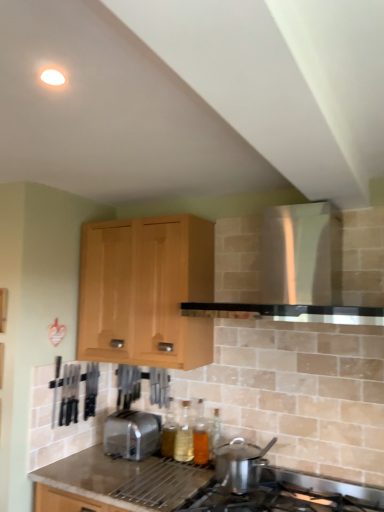
Identify the location of free space in front of satin silver toaster at lower center. (116, 475).